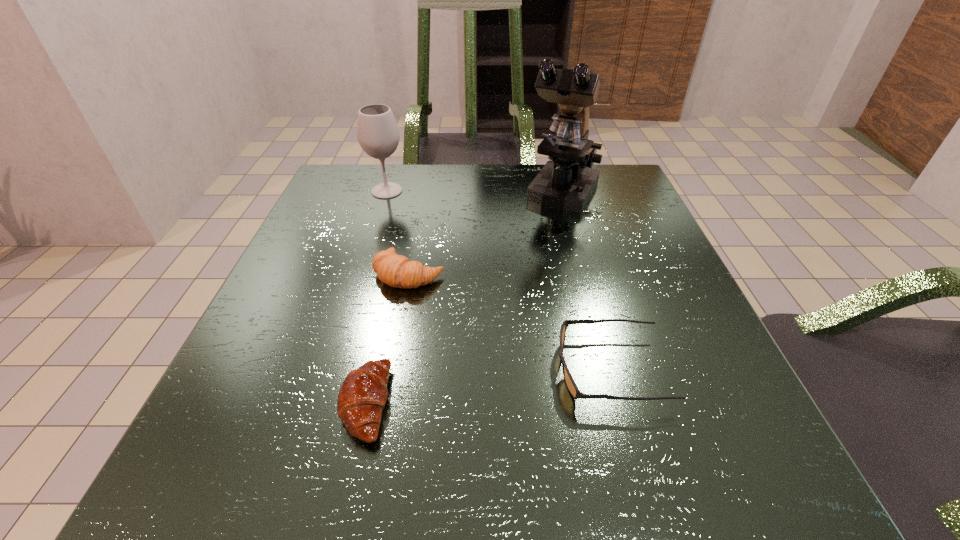
You are a GUI agent. You are given a task and a screenshot of the screen. Output one action in this format:
    pyautogui.click(x=<x>, y=<y>)
    Task: Click on the microscope
    
    Given the screenshot: What is the action you would take?
    pyautogui.click(x=566, y=182)

You are a GUI agent. You are given a task and a screenshot of the screen. Output one action in this format:
    pyautogui.click(x=<x>, y=<y>)
    Task: Click on the second tallest object
    
    Given the screenshot: What is the action you would take?
    pyautogui.click(x=378, y=135)

Image resolution: width=960 pixels, height=540 pixels. I want to click on the third nearest object, so click(397, 271).

The height and width of the screenshot is (540, 960). I want to click on the shorter crescent roll, so click(362, 396).

The image size is (960, 540). I want to click on sunglasses, so click(x=570, y=383).

Locate an element on the screen. This screenshot has width=960, height=540. vacant space located 0.110m on the front of the microscope is located at coordinates (580, 254).

Locate an element on the screen. Image resolution: width=960 pixels, height=540 pixels. vacant area located on the right of the wineglass is located at coordinates (578, 191).

Find the location of a particular element. This screenshot has width=960, height=540. vacant area situated 0.150m on the left of the farther crescent roll is located at coordinates (292, 274).

Where is `vacant area situated 0.060m on the left of the shorter crescent roll`? Image resolution: width=960 pixels, height=540 pixels. vacant area situated 0.060m on the left of the shorter crescent roll is located at coordinates click(x=298, y=403).

Identify the location of vacant region located 0.110m on the front-facing side of the sunglasses. The height and width of the screenshot is (540, 960). (481, 369).